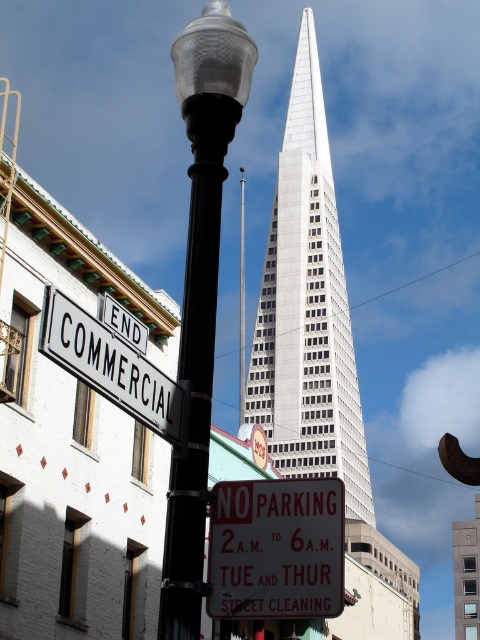
You are a city planner assessing the visibility of street signs. The matte glass lamp post at center and the white metal sign at upper left are both in your line of sight. Which object is taller?

The matte glass lamp post at center is taller than the white metal sign at upper left according to the description.